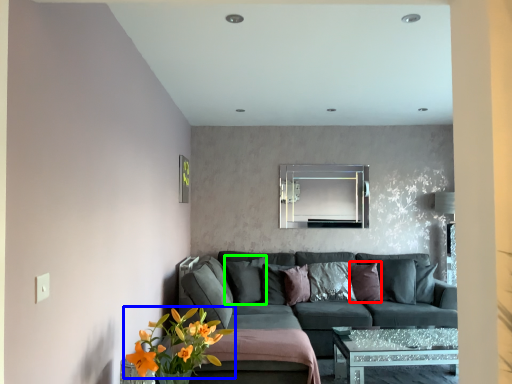
Question: Estimate the real-world distances between objects in this image. Which object is farther from pillow (highlighted by a red box), flower (highlighted by a blue box) or pillow (highlighted by a green box)?

Choices:
 (A) flower
 (B) pillow

Answer: (A)